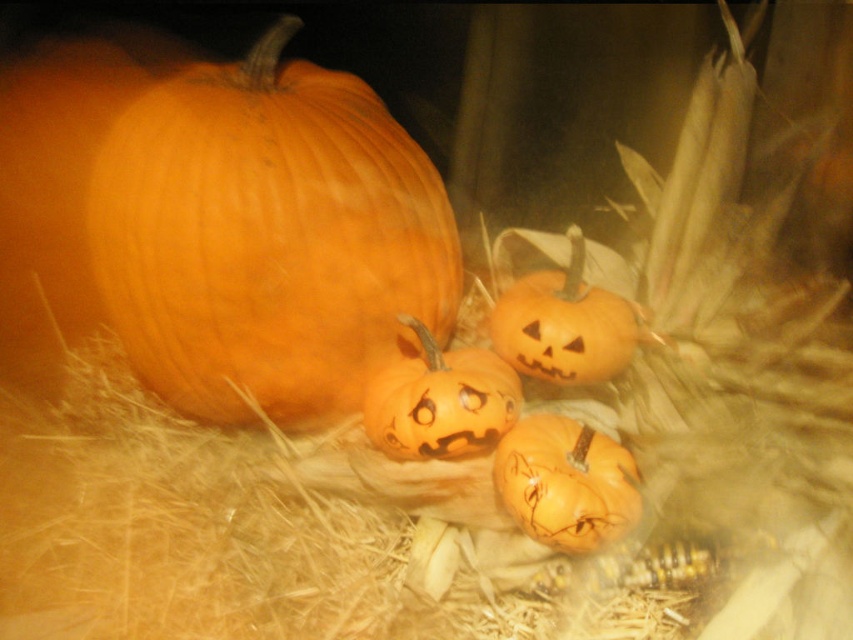
Question: Which is farther from the matte orange pumpkin at lower center?

Choices:
 (A) matte orange pumpkin at center
 (B) orange matte pumpkin at center

Answer: (B)

Question: Where is matte orange pumpkin at center located in relation to orange matte pumpkin at center in the image?

Choices:
 (A) left
 (B) right

Answer: (A)

Question: Which object is closer to the camera taking this photo?

Choices:
 (A) matte orange pumpkin at center
 (B) orange matte pumpkin at center

Answer: (A)

Question: Where is matte orange pumpkin at lower center located in relation to matte orange pumpkin at center in the image?

Choices:
 (A) right
 (B) left

Answer: (A)

Question: Which object is positioned closest to the orange matte pumpkin at center?

Choices:
 (A) orange matte pumpkin at left
 (B) matte orange pumpkin at lower center
 (C) matte orange pumpkin at center

Answer: (C)

Question: Is orange matte pumpkin at left smaller than matte orange pumpkin at center?

Choices:
 (A) yes
 (B) no

Answer: (B)